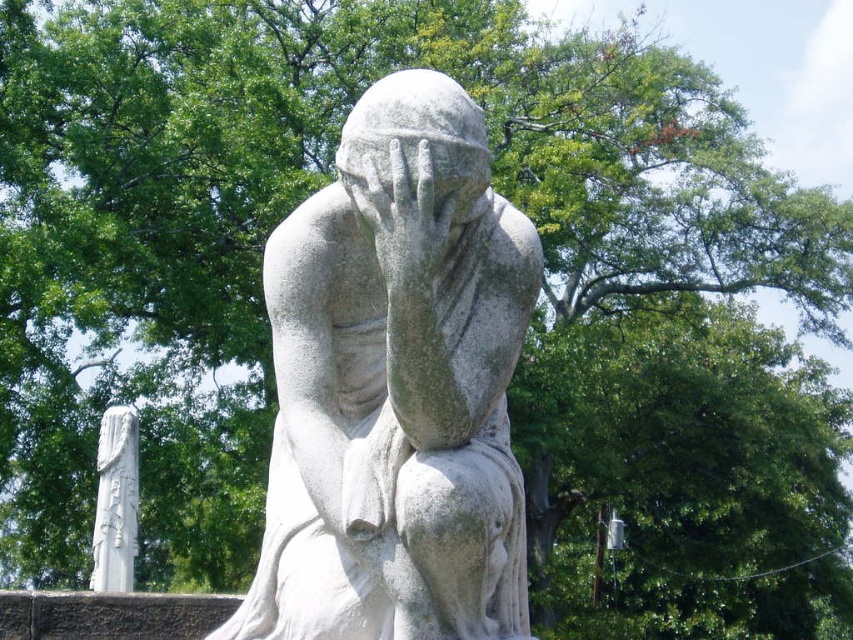
Question: Can you confirm if white stone statue at center is smaller than white stone column at left?

Choices:
 (A) no
 (B) yes

Answer: (A)

Question: Among these objects, which one is farthest from the camera?

Choices:
 (A) white stone column at left
 (B) smooth stone hand at center
 (C) white stone statue at center

Answer: (A)

Question: Does white stone statue at center have a smaller size compared to white stone column at left?

Choices:
 (A) no
 (B) yes

Answer: (A)

Question: Which object is the farthest from the smooth stone hand at center?

Choices:
 (A) white stone statue at center
 (B) white stone column at left

Answer: (B)

Question: Which point is farther from the camera taking this photo?

Choices:
 (A) (378, 228)
 (B) (136, 552)

Answer: (B)

Question: Where is white stone statue at center located in relation to white stone column at left in the image?

Choices:
 (A) below
 (B) above

Answer: (B)